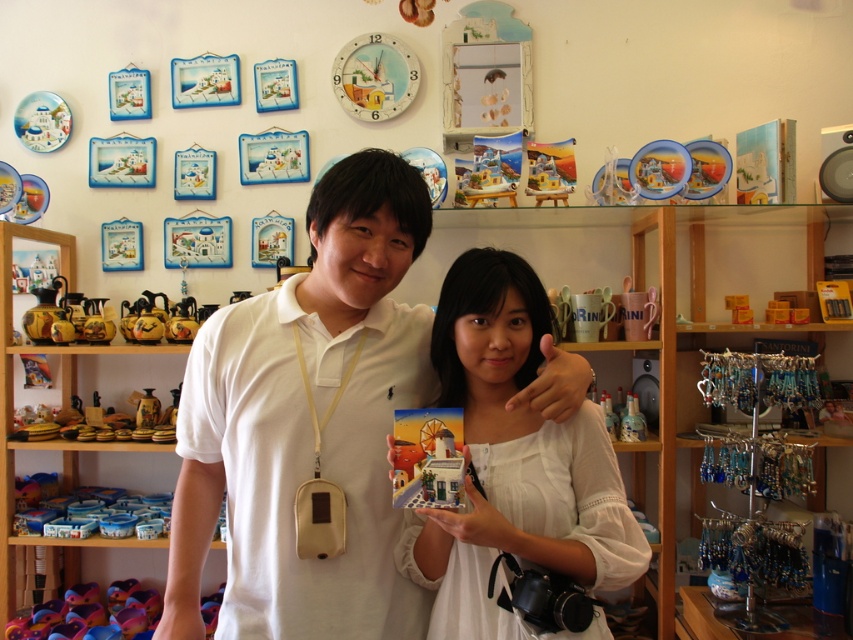
You are a photographer trying to capture a clear shot of the white matte shirt at center in the souvenir shop scene. Based on the coordinates provided, where should you position your camera to ensure the shirt is centered in your frame?

The white matte shirt at center is located at coordinates point [308,422], so positioning the camera to align the center of the frame with these coordinates will ensure the shirt is centered in the shot.

You are a photographer in the souvenir shop and want to take a photo of both the white matte shirt at center and the white matte card at center. Which one should you focus on first if you want to capture both clearly in the same frame?

The white matte shirt at center has a larger size compared to white matte card at center, so you should focus on the white matte shirt at center first to ensure both are in focus.